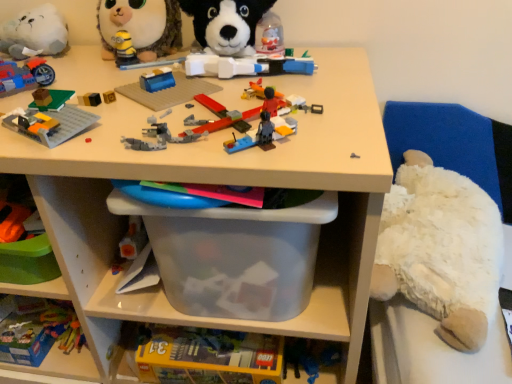
This screenshot has width=512, height=384. I want to click on vacant region above clear plastic bin at center (from a real-world perspective), so click(x=157, y=83).